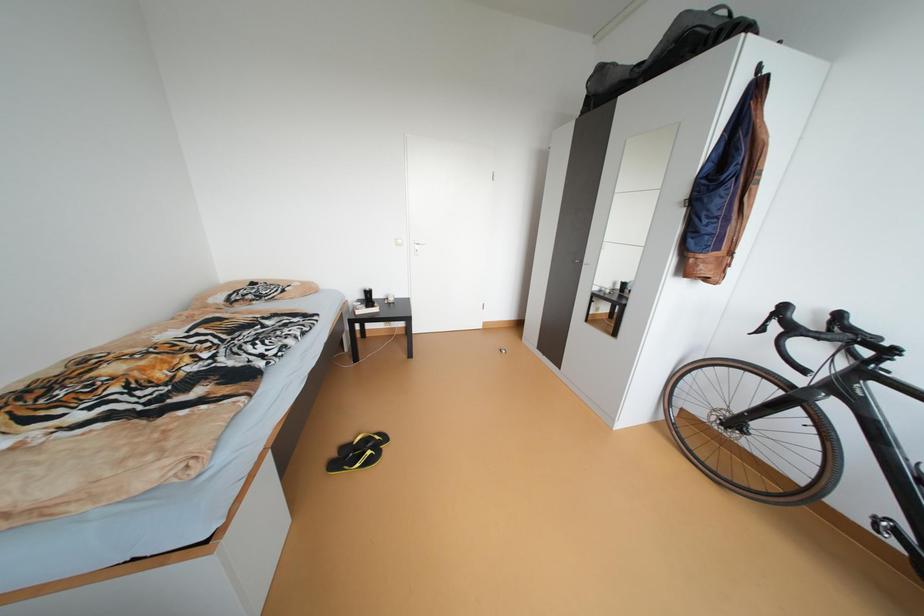
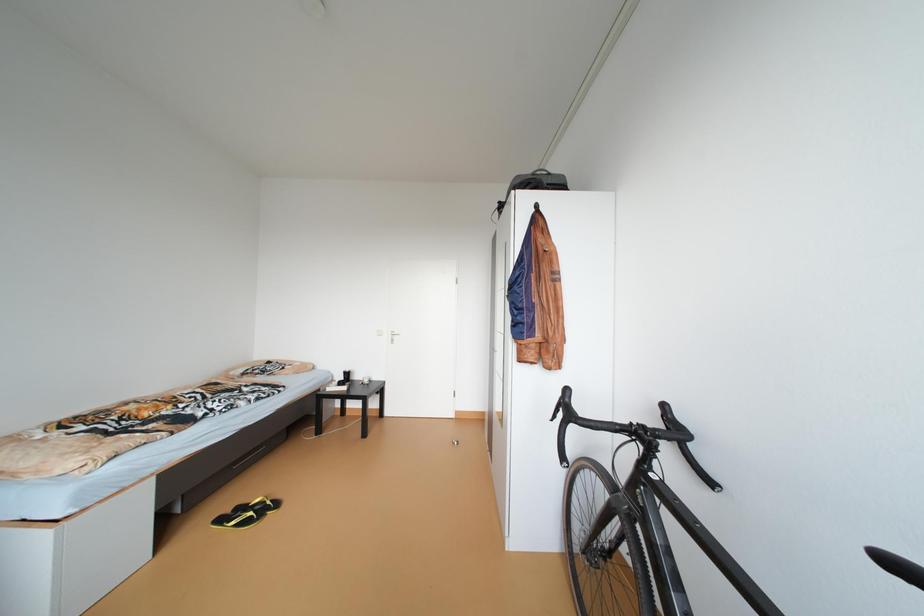
Question: What movement of the cameraman would produce the second image?

Choices:
 (A) Left
 (B) Right
 (C) Forward
 (D) Backward

Answer: (B)